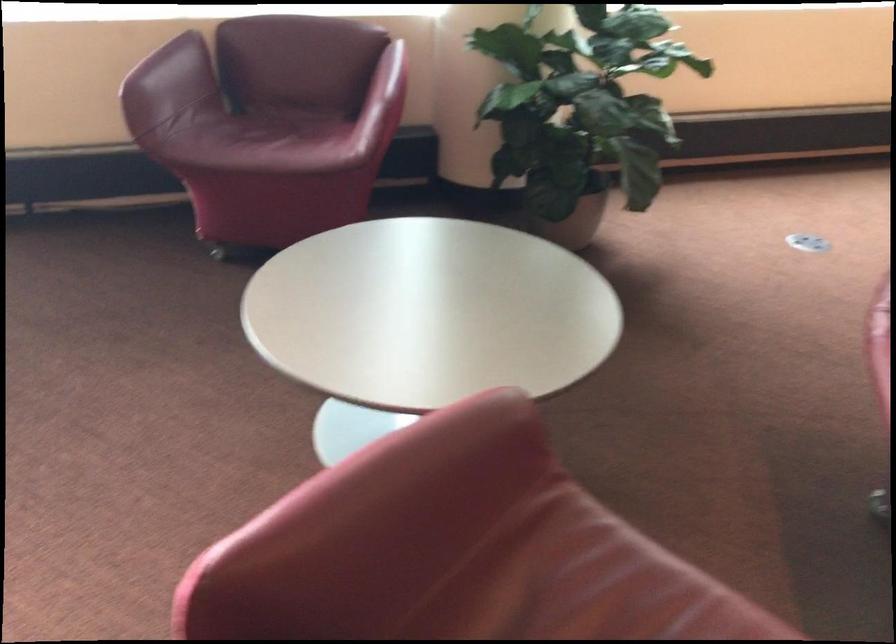
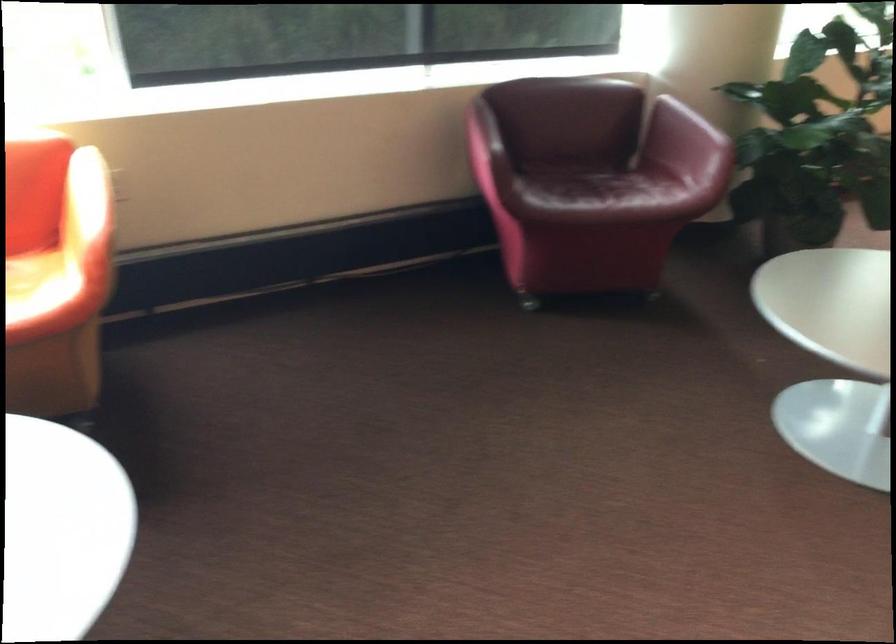
In the second image, find the point that corresponds to the point at 151,84 in the first image.

(483, 140)